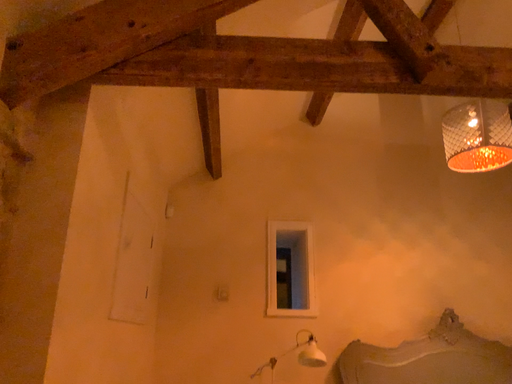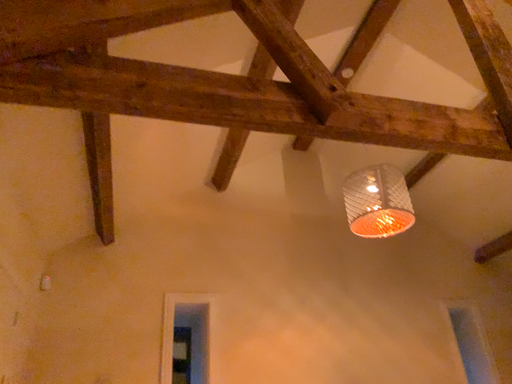
Question: How did the camera likely rotate when shooting the video?

Choices:
 (A) rotated left
 (B) rotated right

Answer: (B)